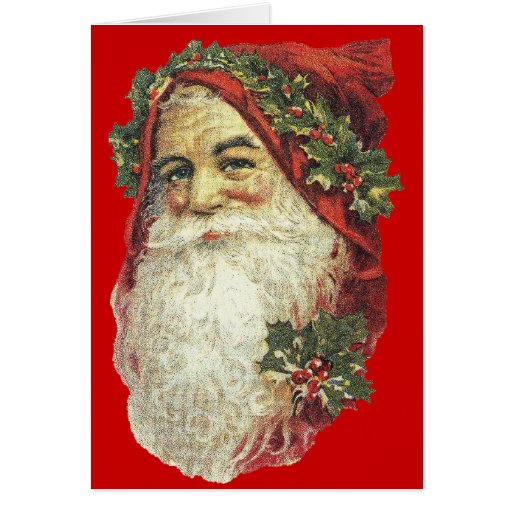
Locate an element on the screen. hood is located at coordinates (327, 66).